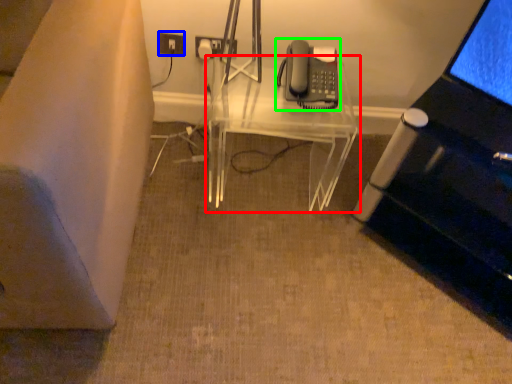
Question: Which is nearer to the table (highlighted by a red box)? electric outlet (highlighted by a blue box) or corded phone (highlighted by a green box).

Choices:
 (A) electric outlet
 (B) corded phone

Answer: (B)